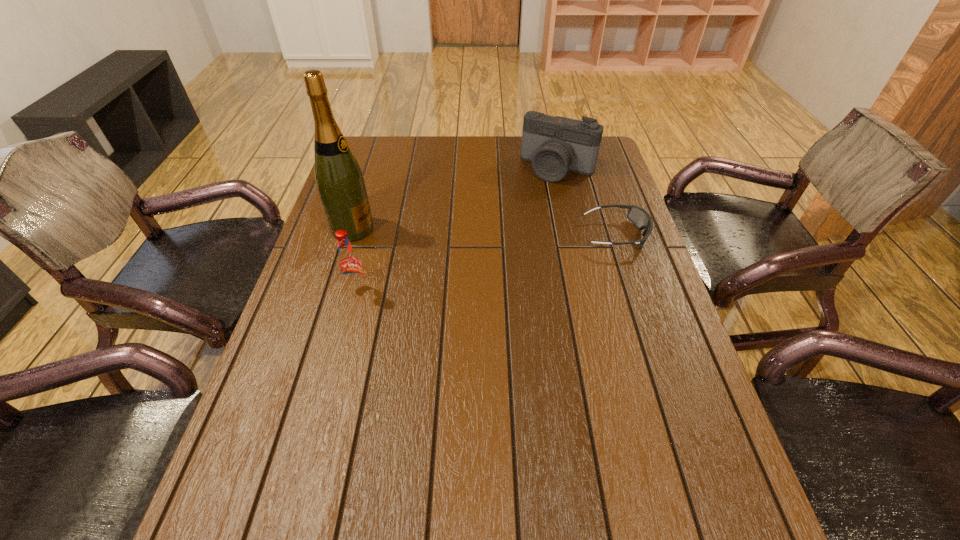
At what (x,y) coordinates should I click in order to perform the action: click on free region at the right edge of the desktop. Please return your answer as a coordinate pair (x, y). Looking at the image, I should click on (633, 228).

Find the location of a particular element. empty space that is in between the goggles and the nearest object is located at coordinates (487, 263).

The height and width of the screenshot is (540, 960). In order to click on free spot between the tallest object and the shortest object in this screenshot , I will do `click(484, 232)`.

Image resolution: width=960 pixels, height=540 pixels. I want to click on free space between the shortest object and the wine bottle, so click(x=484, y=232).

Identify the location of vacant area between the shortest object and the farthest object. (587, 201).

Image resolution: width=960 pixels, height=540 pixels. In order to click on free point between the root beer and the camera in this screenshot , I will do `click(458, 230)`.

The image size is (960, 540). Find the location of `vacant space in between the tallest object and the shortest object`. vacant space in between the tallest object and the shortest object is located at coordinates (484, 232).

Locate an element on the screen. vacant space in between the farthest object and the nearest object is located at coordinates (458, 230).

Locate an element on the screen. The height and width of the screenshot is (540, 960). vacant point located between the camera and the root beer is located at coordinates (458, 230).

Find the location of a particular element. This screenshot has height=540, width=960. object that is the second closest one to the tallest object is located at coordinates (555, 145).